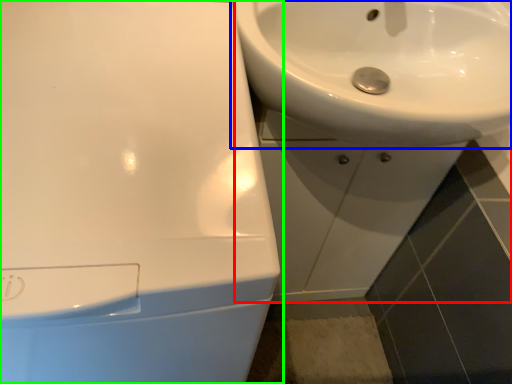
Question: Estimate the real-world distances between objects in this image. Which object is closer to sink (highlighted by a red box), sink (highlighted by a blue box) or sink (highlighted by a green box)?

Choices:
 (A) sink
 (B) sink

Answer: (A)